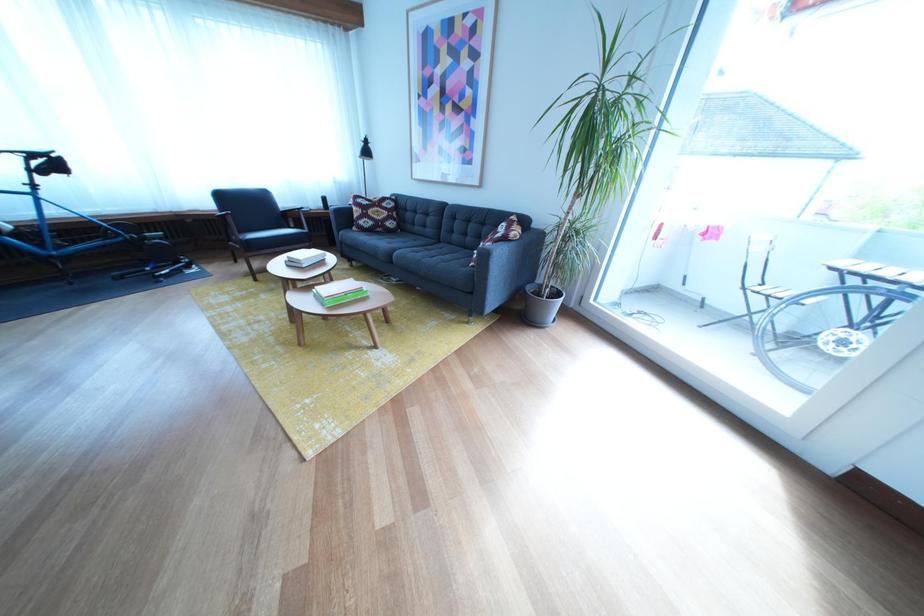
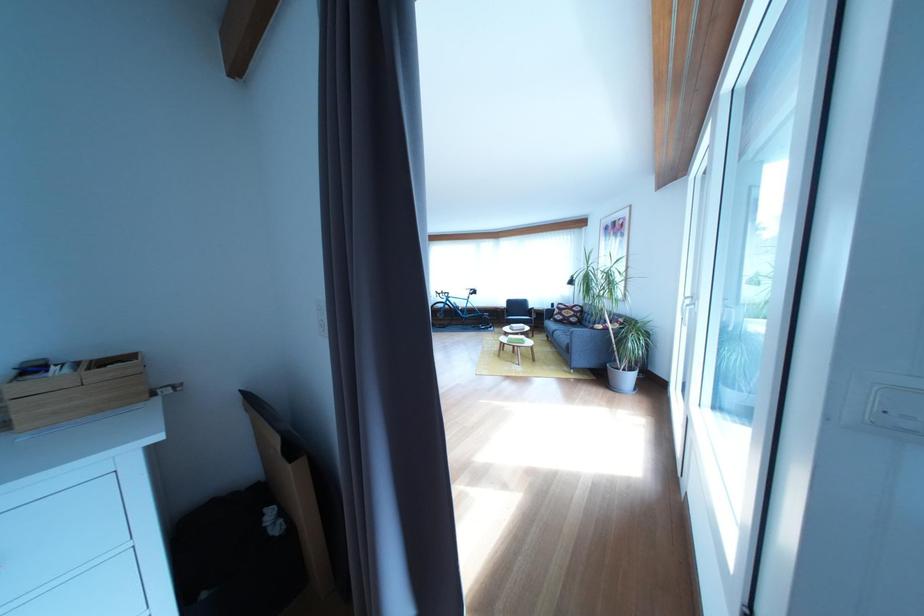
Find the pixel in the second image that matches (403,238) in the first image.

(585, 330)